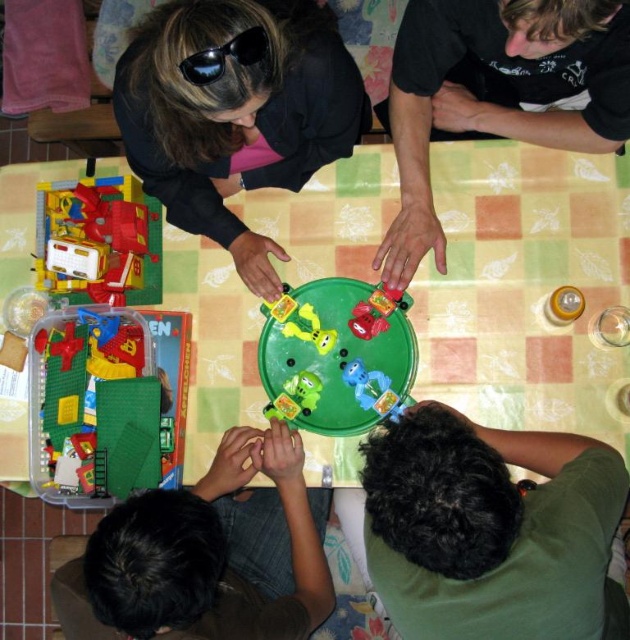
You are organizing a toy store shelf. You have a black matte toy car at center and a translucent yellow bottle at upper right. Which toy takes up more space on the shelf?

The black matte toy car at center takes up more space on the shelf because it has a larger size compared to the translucent yellow bottle at upper right.

You are standing in front of the table and want to place a 1.1 meter long object on the green plastic table at center. Will the object fit on the table?

The green plastic table at center is 1.13 meters away from the camera, but this distance does not indicate the table size. The question about the object fitting cannot be determined from the provided information.